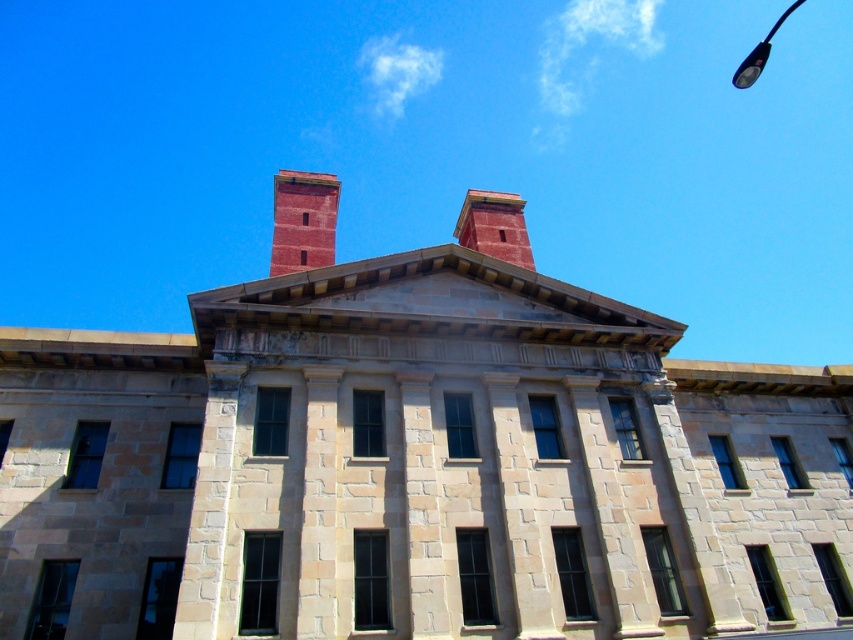
Question: Which point appears closest to the camera in this image?

Choices:
 (A) (749, 77)
 (B) (285, 244)
 (C) (485, 237)

Answer: (B)

Question: Among these points, which one is farthest from the camera?

Choices:
 (A) (294, 204)
 (B) (492, 198)

Answer: (B)

Question: Does brick chimney at center have a greater width compared to metallic pole at upper right?

Choices:
 (A) no
 (B) yes

Answer: (A)

Question: Which point is farther to the camera?

Choices:
 (A) metallic pole at upper right
 (B) smooth brick chimney at upper center
 (C) brick chimney at center

Answer: (A)

Question: In this image, where is brick chimney at center located relative to metallic pole at upper right?

Choices:
 (A) below
 (B) above

Answer: (A)

Question: Is brick chimney at center to the left of metallic pole at upper right from the viewer's perspective?

Choices:
 (A) no
 (B) yes

Answer: (B)